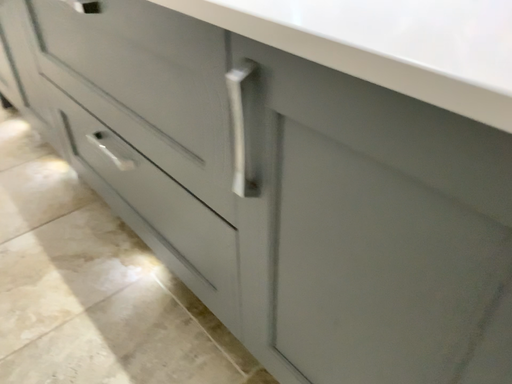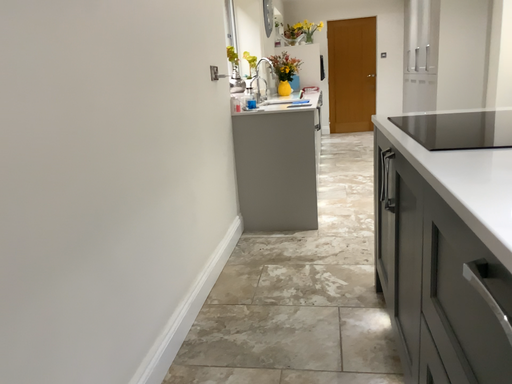
Question: How did the camera likely rotate when shooting the video?

Choices:
 (A) rotated left
 (B) rotated right

Answer: (A)